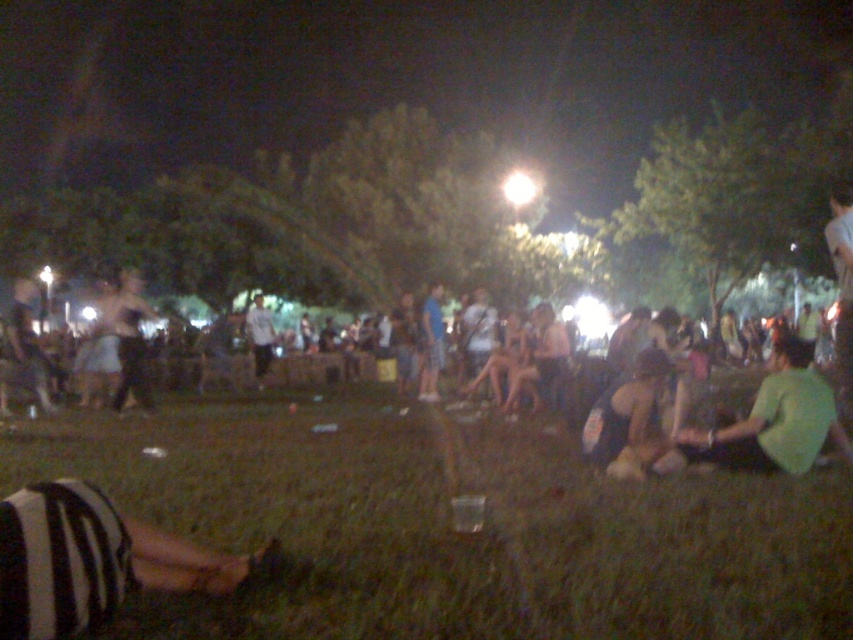
You are a photographer at the event and want to capture a clear shot of the green grass at lower center without the dark clothing crowd at center blocking it. How can you adjust your camera angle to achieve this?

Since the green grass at lower center is positioned under the dark clothing crowd at center, you can lower your camera angle to look upward, positioning it below the crowd to capture the grass without obstruction.

You are standing at the point marked as point (451, 525) in the image. What is the immediate surface you are standing on?

The immediate surface you are standing on is the green grass at lower center.

You are a photographer standing in the park at night. You see the green grass at lower center and the dark gray striped shirt at left. Which object is positioned lower in the image?

The green grass at lower center is positioned below the dark gray striped shirt at left, so it is lower in the image.